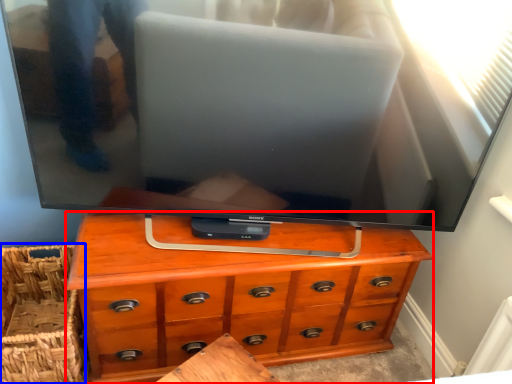
Question: Among these objects, which one is farthest to the camera, chest of drawers (highlighted by a red box) or basket (highlighted by a blue box)?

Choices:
 (A) chest of drawers
 (B) basket

Answer: (B)